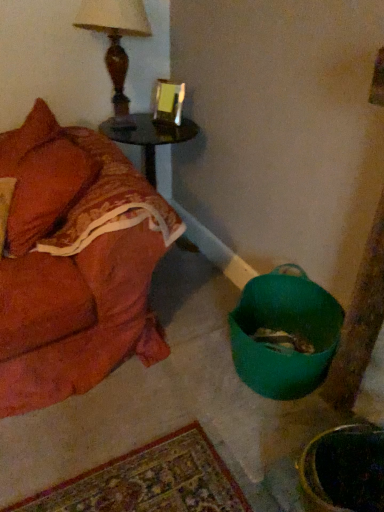
Find the location of `vacant point above shiny dark wood side table at upper left (from a real-world perspective)`. vacant point above shiny dark wood side table at upper left (from a real-world perspective) is located at coordinates (148, 124).